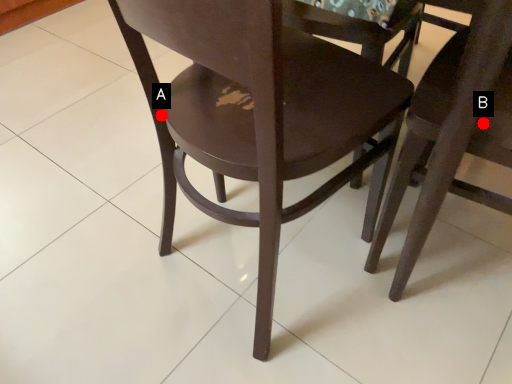
Question: Two points are circled on the image, labeled by A and B beside each circle. Which of the following is the closest to the observer?

Choices:
 (A) A is closer
 (B) B is closer

Answer: (B)